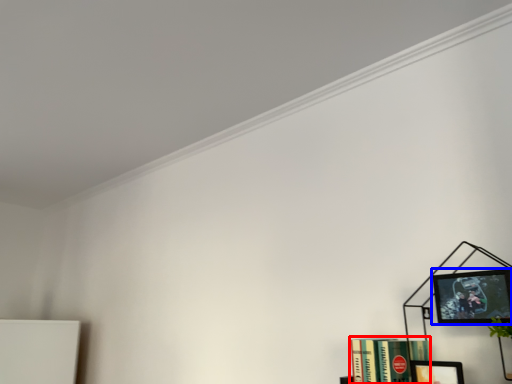
Question: Which point is closer to the camera, book (highlighted by a red box) or picture frame (highlighted by a blue box)?

Choices:
 (A) book
 (B) picture frame

Answer: (B)